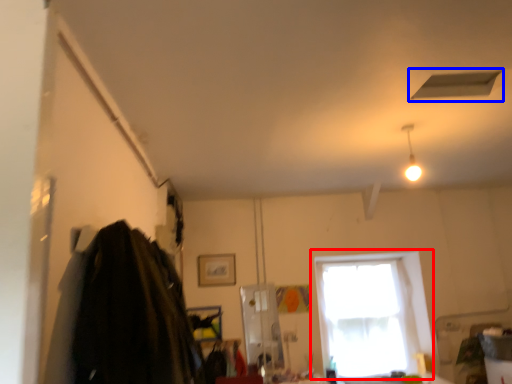
Question: Among these objects, which one is farthest to the camera, window (highlighted by a red box) or exhaust hood (highlighted by a blue box)?

Choices:
 (A) window
 (B) exhaust hood

Answer: (A)